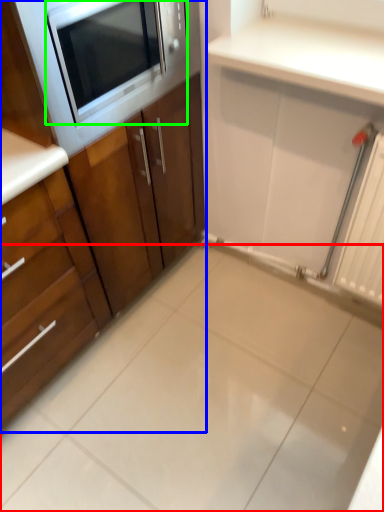
Question: Which object is the closest to the ceramic tile (highlighted by a red box)? Choose among these: cabinetry (highlighted by a blue box) or microwave oven (highlighted by a green box).

Choices:
 (A) cabinetry
 (B) microwave oven

Answer: (A)